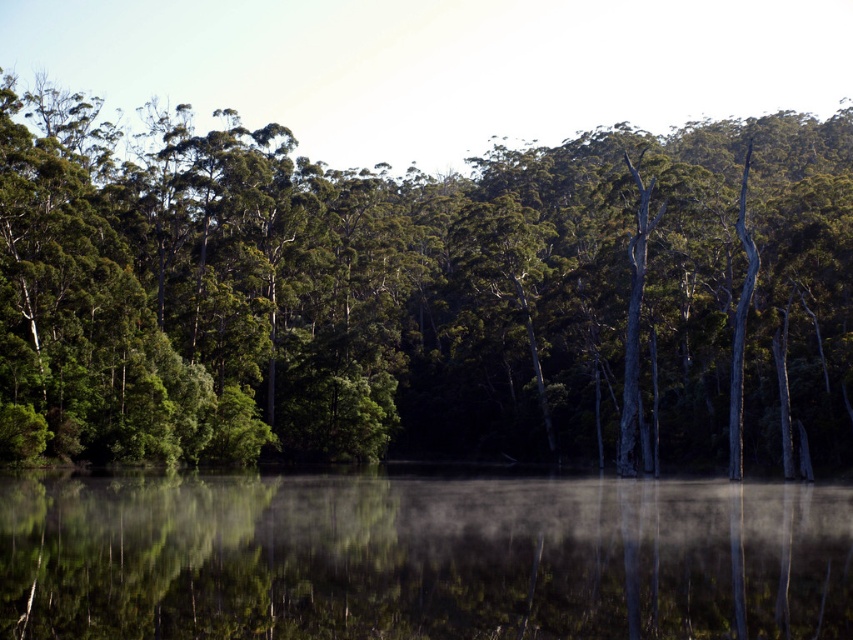
You are an environmental scientist assessing the scene. You need to determine which object occupies more space in the image between the green matte tree at center and the transparent misty water at center. Which one is larger?

The green matte tree at center has a larger size compared to the transparent misty water at center, so the green matte tree at center occupies more space in the image.

You are standing at point (422, 296) in the forest scene. What object is located exactly at your current position?

The green matte tree at center is located exactly at point (422, 296).